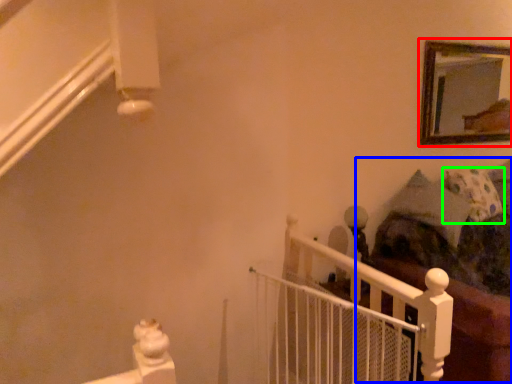
Question: Which is nearer to the picture frame (highlighted by a red box)? bed (highlighted by a blue box) or pillow (highlighted by a green box).

Choices:
 (A) bed
 (B) pillow

Answer: (B)